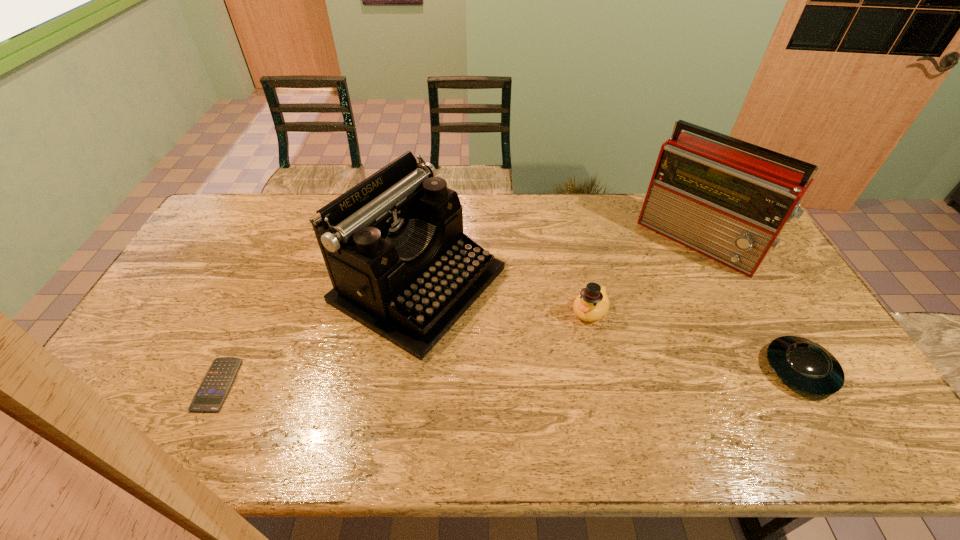
You are a GUI agent. You are given a task and a screenshot of the screen. Output one action in this format:
    pyautogui.click(x=<x>, y=<y>)
    Task: Click on the calculator that is at the near edge
    The width and height of the screenshot is (960, 540).
    Given the screenshot: What is the action you would take?
    tap(218, 380)

This screenshot has width=960, height=540. I want to click on saucer situated at the near edge, so [x=803, y=364].

This screenshot has height=540, width=960. In order to click on saucer that is at the right edge in this screenshot , I will do `click(803, 364)`.

The image size is (960, 540). I want to click on radio receiver that is at the right edge, so click(730, 206).

Where is `object at the far right corner`? This screenshot has width=960, height=540. object at the far right corner is located at coordinates (730, 206).

Where is `object situated at the near right corner`? The height and width of the screenshot is (540, 960). object situated at the near right corner is located at coordinates (803, 364).

At what (x,y) coordinates should I click in order to perform the action: click on free space at the far edge of the desktop. Please return your answer as a coordinate pair (x, y). Looking at the image, I should click on (500, 204).

Find the location of a particular element. This screenshot has height=540, width=960. vacant space at the near edge is located at coordinates (782, 387).

The width and height of the screenshot is (960, 540). I want to click on vacant space at the left edge of the desktop, so click(187, 289).

I want to click on free spot at the right edge of the desktop, so click(756, 319).